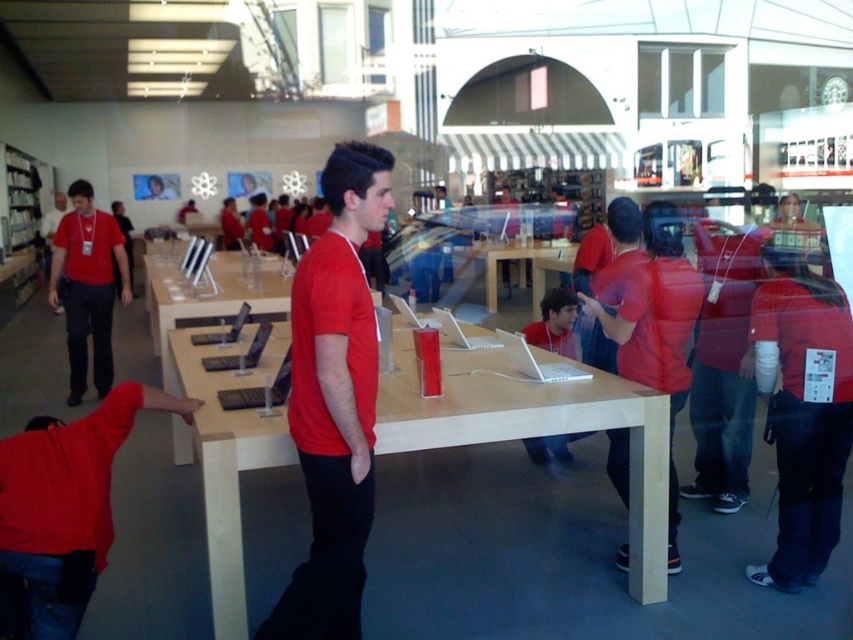
Identify the location of white fabric pants at lower right. This screenshot has width=853, height=640. (802, 410).

Does white fabric pants at lower right have a lesser width compared to matte red shirt at left?

Correct, white fabric pants at lower right's width is less than matte red shirt at left's.

Is point (840, 445) farther from viewer compared to point (94, 300)?

No.

I want to click on white fabric pants at lower right, so click(802, 410).

Between white fabric pants at lower right and matte red shirt at lower left, which one is positioned higher?

white fabric pants at lower right

Does point (805, 433) lie in front of point (94, 497)?

That is False.

Locate an element on the screen. Image resolution: width=853 pixels, height=640 pixels. white fabric pants at lower right is located at coordinates (802, 410).

Can you confirm if matte red shirt at left is shorter than wooden table at center?

Incorrect, matte red shirt at left's height does not fall short of wooden table at center's.

Does matte red shirt at left have a smaller size compared to wooden table at center?

Yes, matte red shirt at left is smaller than wooden table at center.

Between point (57, 234) and point (485, 291), which one is positioned behind?

Point (485, 291)

Identify the location of matte red shirt at left. (86, 285).